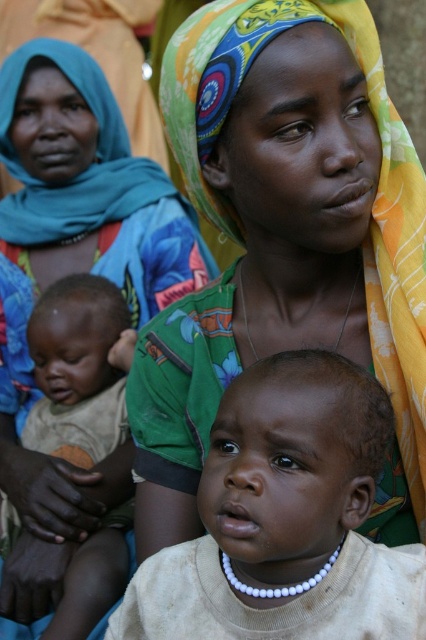
Question: Does matte green scarf at center come in front of light brown skin baby at center?

Choices:
 (A) yes
 (B) no

Answer: (A)

Question: Can you confirm if light beige fabric at center is smaller than light brown skin baby at center?

Choices:
 (A) yes
 (B) no

Answer: (A)

Question: Does matte green scarf at center have a smaller size compared to light beige fabric at center?

Choices:
 (A) no
 (B) yes

Answer: (A)

Question: Which point appears closest to the camera in this image?

Choices:
 (A) (377, 456)
 (B) (45, 445)
 (C) (172, 333)

Answer: (A)

Question: Considering the real-world distances, which object is closest to the light brown skin baby at center?

Choices:
 (A) light beige fabric at center
 (B) matte green scarf at center

Answer: (B)

Question: Based on their relative distances, which object is farther from the matte green scarf at center?

Choices:
 (A) light brown skin baby at center
 (B) light beige fabric at center

Answer: (A)